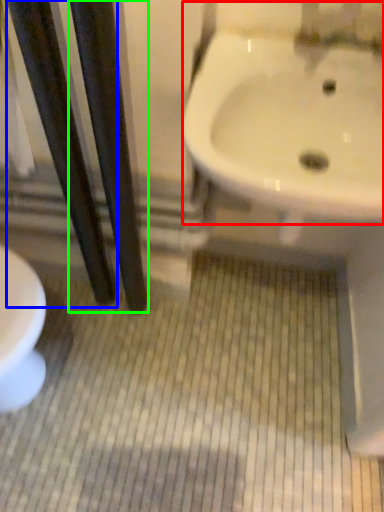
Question: Which is nearer to the sink (highlighted by a red box)? pole (highlighted by a blue box) or pole (highlighted by a green box).

Choices:
 (A) pole
 (B) pole

Answer: (B)